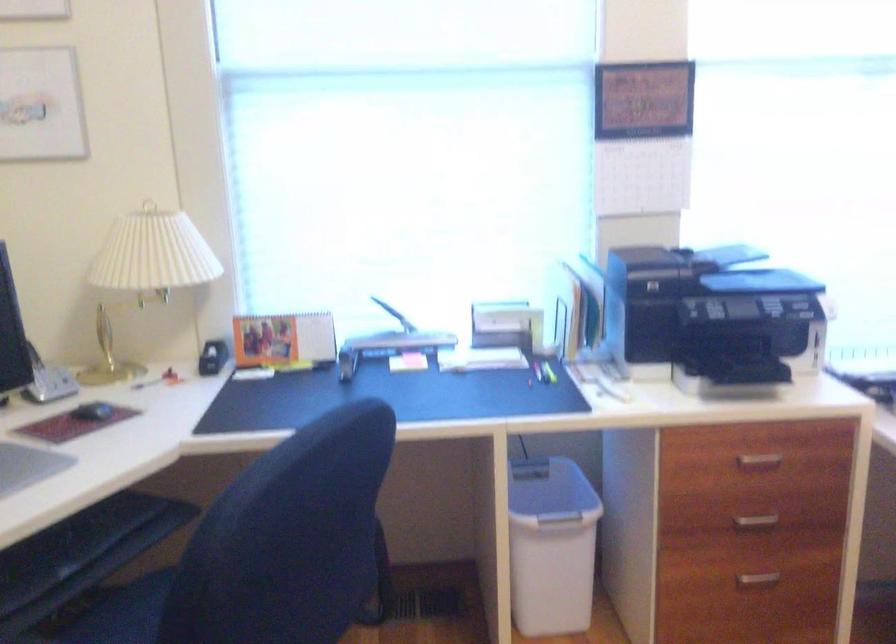
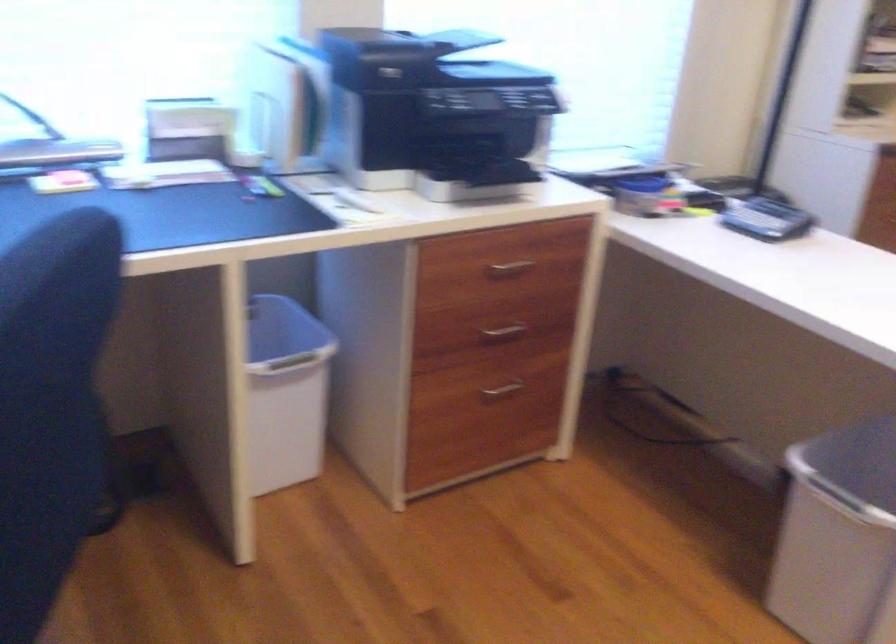
The point at (760, 462) is marked in the first image. Where is the corresponding point in the second image?

(510, 268)